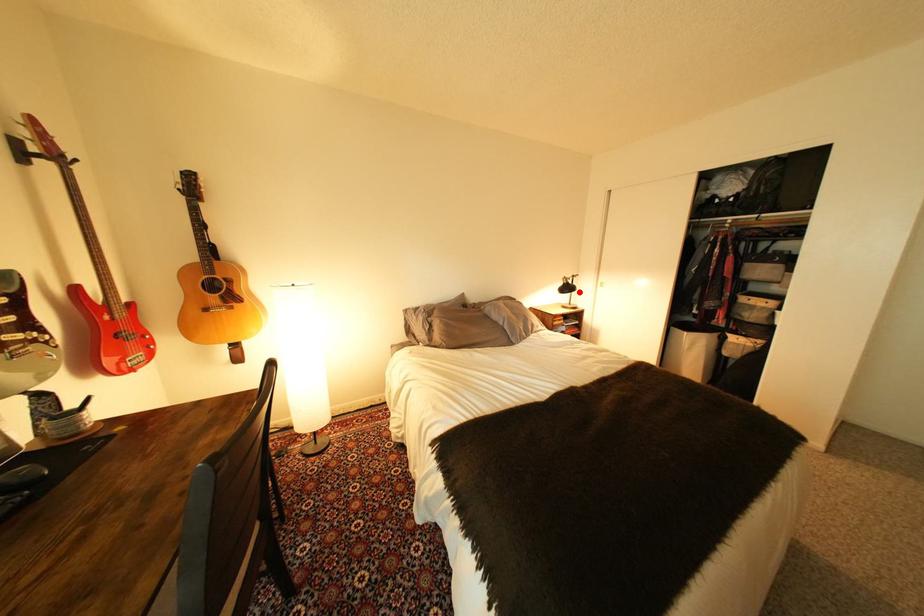
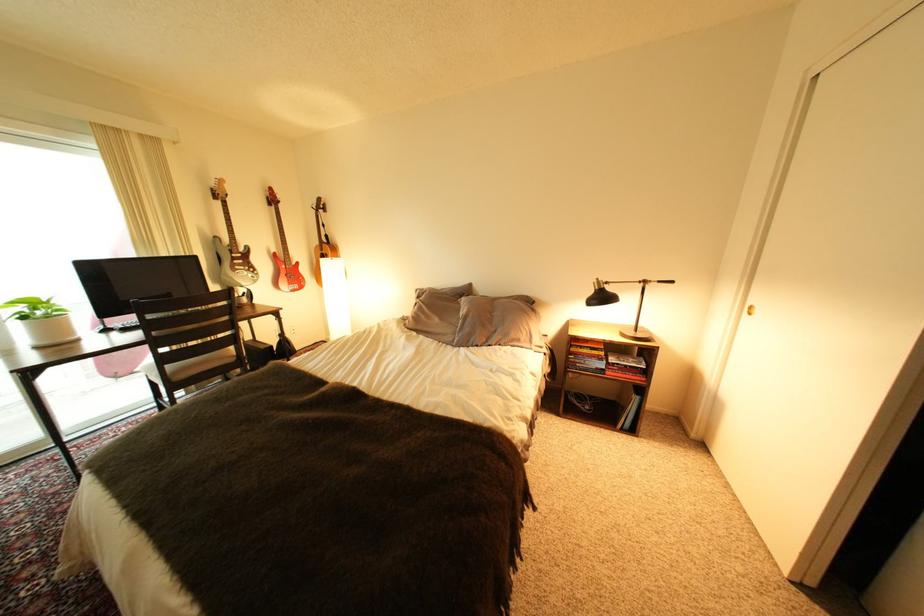
Question: I am providing you with two images of the same scene from different viewpoints. A red point is marked on the first image. Is the red point's position out of view in image 2?

Choices:
 (A) Yes
 (B) No

Answer: (B)